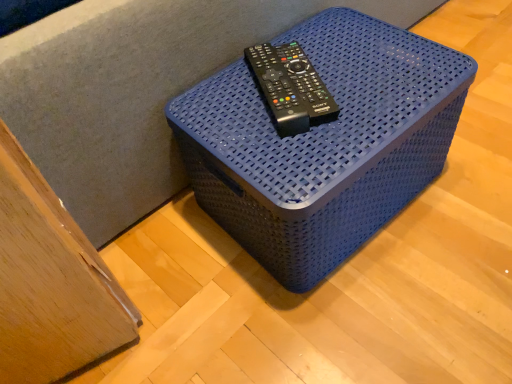
Question: Do you think blue woven basket at center is within black plastic remote control at center, or outside of it?

Choices:
 (A) inside
 (B) outside

Answer: (B)

Question: Is blue woven basket at center taller or shorter than black plastic remote control at center?

Choices:
 (A) tall
 (B) short

Answer: (A)

Question: Is blue woven basket at center bigger or smaller than black plastic remote control at center?

Choices:
 (A) big
 (B) small

Answer: (A)

Question: Is point (309, 117) positioned closer to the camera than point (415, 195)?

Choices:
 (A) closer
 (B) farther

Answer: (A)

Question: Considering the positions of black plastic remote control at center and blue woven basket at center in the image, is black plastic remote control at center wider or thinner than blue woven basket at center?

Choices:
 (A) thin
 (B) wide

Answer: (A)

Question: Considering the positions of black plastic remote control at center and blue woven basket at center in the image, is black plastic remote control at center taller or shorter than blue woven basket at center?

Choices:
 (A) short
 (B) tall

Answer: (A)

Question: From the image's perspective, is black plastic remote control at center positioned above or below blue woven basket at center?

Choices:
 (A) below
 (B) above

Answer: (B)